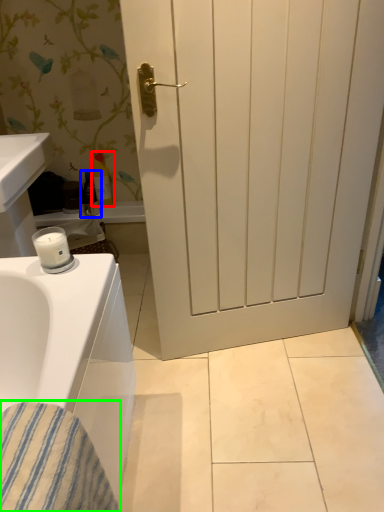
Question: Based on their relative distances, which object is farther from toiletry (highlighted by a red box)? Choose from toiletry (highlighted by a blue box) and material (highlighted by a green box).

Choices:
 (A) toiletry
 (B) material

Answer: (B)